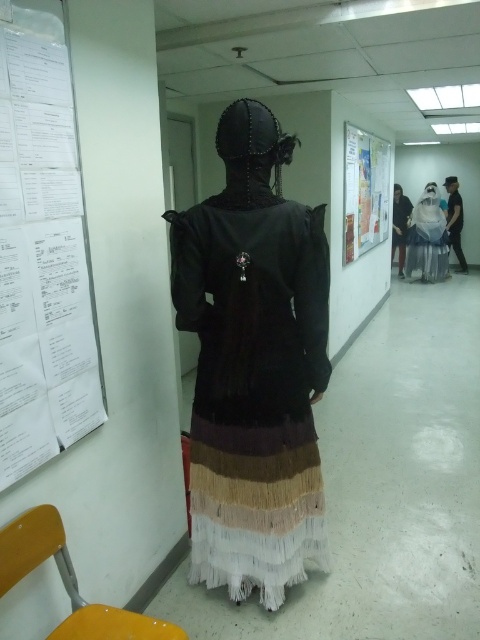
Question: Is black leather dress at center closer to the viewer compared to white paper poster at upper right?

Choices:
 (A) yes
 (B) no

Answer: (A)

Question: Which object is farther from the camera taking this photo?

Choices:
 (A) black leather jacket at right
 (B) black leather dress at center
 (C) white fabric bag at center
 (D) white paper at left

Answer: (A)

Question: Does black leather dress at center have a smaller size compared to black leather jacket at right?

Choices:
 (A) no
 (B) yes

Answer: (A)

Question: Can you confirm if black leather dress at center is positioned above white fabric bag at center?

Choices:
 (A) no
 (B) yes

Answer: (A)

Question: Which object is closer to the camera taking this photo?

Choices:
 (A) black leather jacket at right
 (B) white paper at left
 (C) white satin dress at center

Answer: (B)

Question: Which of the following is the closest to the observer?

Choices:
 (A) black leather jacket at right
 (B) black leather dress at center
 (C) white satin dress at center

Answer: (B)